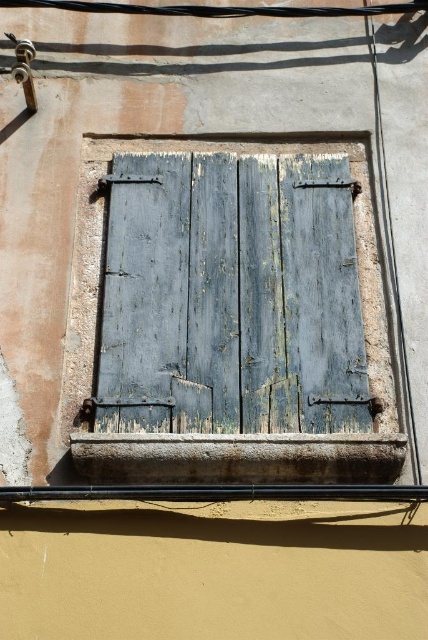
Question: Which object is farther from the camera taking this photo?

Choices:
 (A) weathered wood shutters at center
 (B) rusty concrete window sill at lower center

Answer: (A)

Question: Is weathered wood shutters at center bigger than rusty concrete window sill at lower center?

Choices:
 (A) yes
 (B) no

Answer: (A)

Question: Does weathered wood shutters at center have a smaller size compared to rusty concrete window sill at lower center?

Choices:
 (A) yes
 (B) no

Answer: (B)

Question: Is weathered wood shutters at center thinner than rusty concrete window sill at lower center?

Choices:
 (A) yes
 (B) no

Answer: (B)